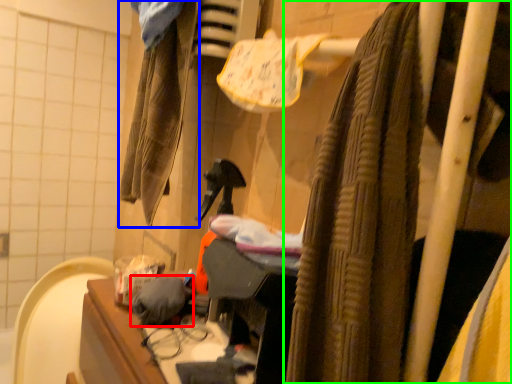
Question: Which object is positioned farthest from clothing (highlighted by a red box)? Select from clothing (highlighted by a blue box) and curtain (highlighted by a green box).

Choices:
 (A) clothing
 (B) curtain

Answer: (A)